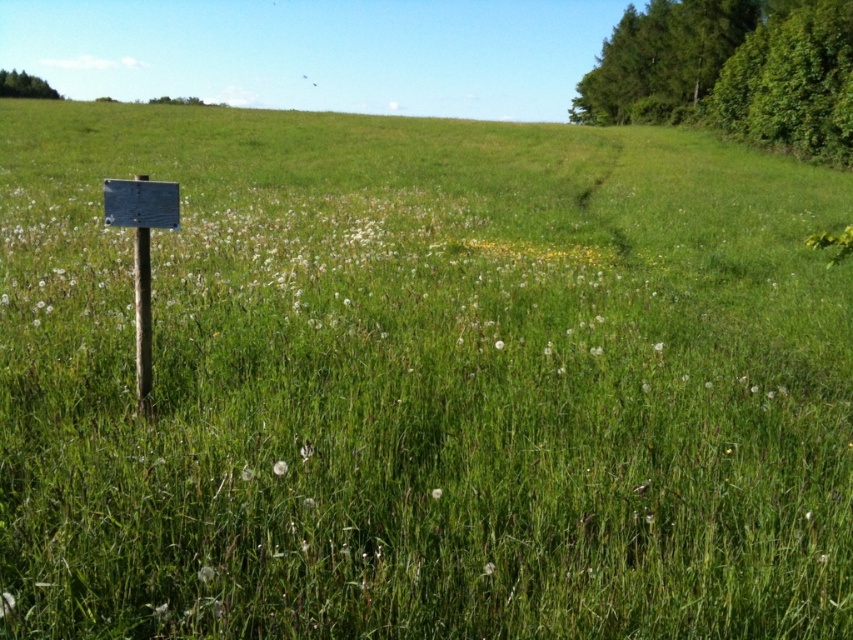
Is metallic signpost at left wider than green leafy tree at upper left?

No, metallic signpost at left is not wider than green leafy tree at upper left.

Who is higher up, metallic signpost at left or green leafy tree at upper left?

A: green leafy tree at upper left is above.

This screenshot has height=640, width=853. I want to click on metallic signpost at left, so click(x=142, y=316).

Can you confirm if green leafy tree at upper right is positioned above metallic signpost at left?

Yes.

Can you confirm if green leafy tree at upper right is bigger than metallic signpost at left?

Yes, green leafy tree at upper right is bigger than metallic signpost at left.

Measure the distance between point [842,141] and camera.

30.90 meters

Locate an element on the screen. Image resolution: width=853 pixels, height=640 pixels. green leafy tree at upper right is located at coordinates (730, 72).

Who is lower down, green leafy tree at upper right or green leafy tree at upper left?

green leafy tree at upper right is below.

Is green leafy tree at upper right taller than green leafy tree at upper left?

Correct, green leafy tree at upper right is much taller as green leafy tree at upper left.

Where is `green leafy tree at upper right`? This screenshot has height=640, width=853. green leafy tree at upper right is located at coordinates (730, 72).

Locate an element on the screen. The image size is (853, 640). green leafy tree at upper right is located at coordinates (730, 72).